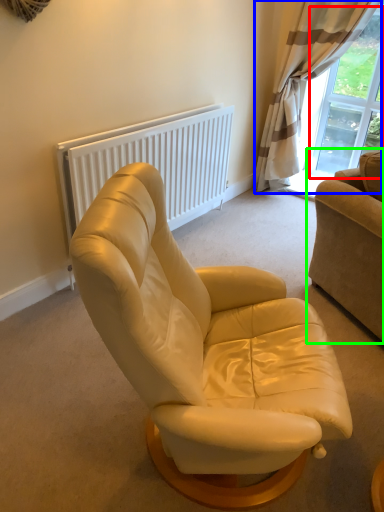
Question: Which object is the farthest from window screen (highlighted by a red box)? Choose among these: curtain (highlighted by a blue box) or studio couch (highlighted by a green box).

Choices:
 (A) curtain
 (B) studio couch

Answer: (B)